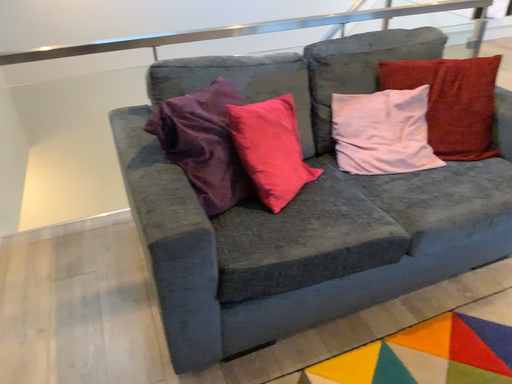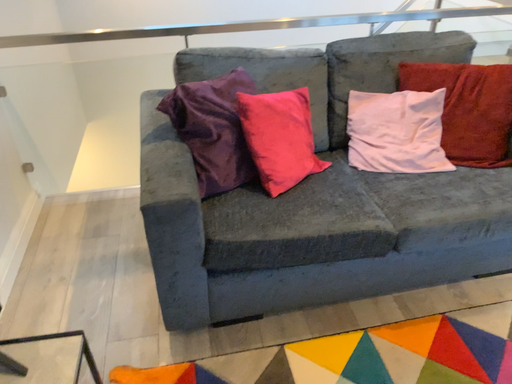
Question: How did the camera likely rotate when shooting the video?

Choices:
 (A) rotated right
 (B) rotated left

Answer: (B)